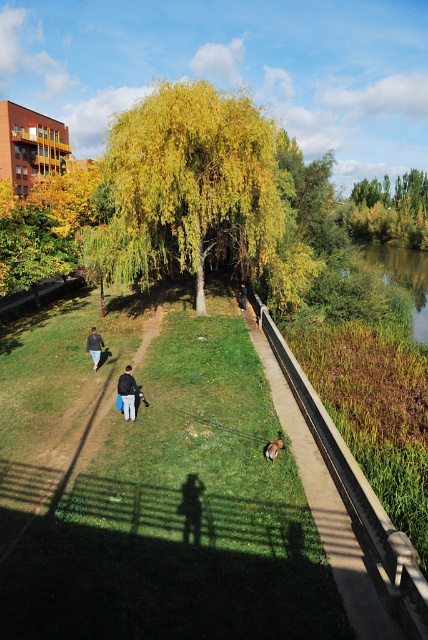
You are a photographer planning to take a photo of the green leafy tree at upper center and the dark blue fabric jacket at center. Based on their sizes in the image, which object would appear larger in the photo?

The green leafy tree at upper center is much taller than the dark blue fabric jacket at center, so it would appear larger in the photo.